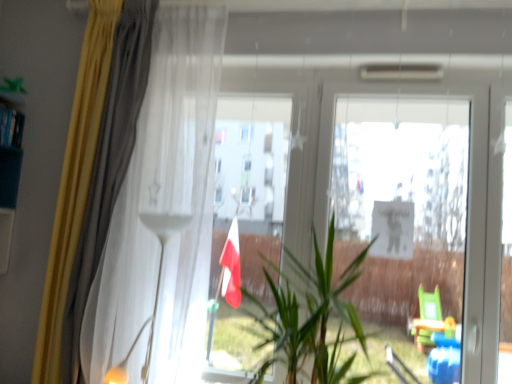
Question: Considering the relative sizes of white glossy floor lamp at upper center and green leafy plant at center in the image provided, is white glossy floor lamp at upper center smaller than green leafy plant at center?

Choices:
 (A) yes
 (B) no

Answer: (A)

Question: From the image's perspective, is white glossy floor lamp at upper center on top of green leafy plant at center?

Choices:
 (A) yes
 (B) no

Answer: (B)

Question: Is white glossy floor lamp at upper center positioned with its back to green leafy plant at center?

Choices:
 (A) no
 (B) yes

Answer: (A)

Question: Could you tell me if white glossy floor lamp at upper center is facing green leafy plant at center?

Choices:
 (A) no
 (B) yes

Answer: (A)

Question: Is white glossy floor lamp at upper center in contact with green leafy plant at center?

Choices:
 (A) yes
 (B) no

Answer: (B)

Question: Does white glossy floor lamp at upper center have a lesser width compared to green leafy plant at center?

Choices:
 (A) no
 (B) yes

Answer: (B)

Question: Is green leafy plant at center further to the viewer compared to white sheer curtain at left, acting as the second curtain starting from the left?

Choices:
 (A) yes
 (B) no

Answer: (B)

Question: Can you confirm if green leafy plant at center is wider than white sheer curtain at left, the first curtain viewed from the right?

Choices:
 (A) no
 (B) yes

Answer: (B)

Question: Considering the relative sizes of green leafy plant at center and white sheer curtain at left, acting as the second curtain starting from the left, in the image provided, is green leafy plant at center bigger than white sheer curtain at left, acting as the second curtain starting from the left,?

Choices:
 (A) yes
 (B) no

Answer: (A)

Question: From the image's perspective, is green leafy plant at center located beneath white sheer curtain at left, the first curtain viewed from the right?

Choices:
 (A) no
 (B) yes

Answer: (B)

Question: Can you confirm if green leafy plant at center is positioned to the right of white sheer curtain at left, the first curtain viewed from the right?

Choices:
 (A) yes
 (B) no

Answer: (A)

Question: From a real-world perspective, is green leafy plant at center over white sheer curtain at left, acting as the second curtain starting from the left?

Choices:
 (A) yes
 (B) no

Answer: (B)

Question: From the image's perspective, is white glossy floor lamp at upper center on top of yellow fabric curtain at left, which is counted as the 1th curtain, starting from the left?

Choices:
 (A) no
 (B) yes

Answer: (A)